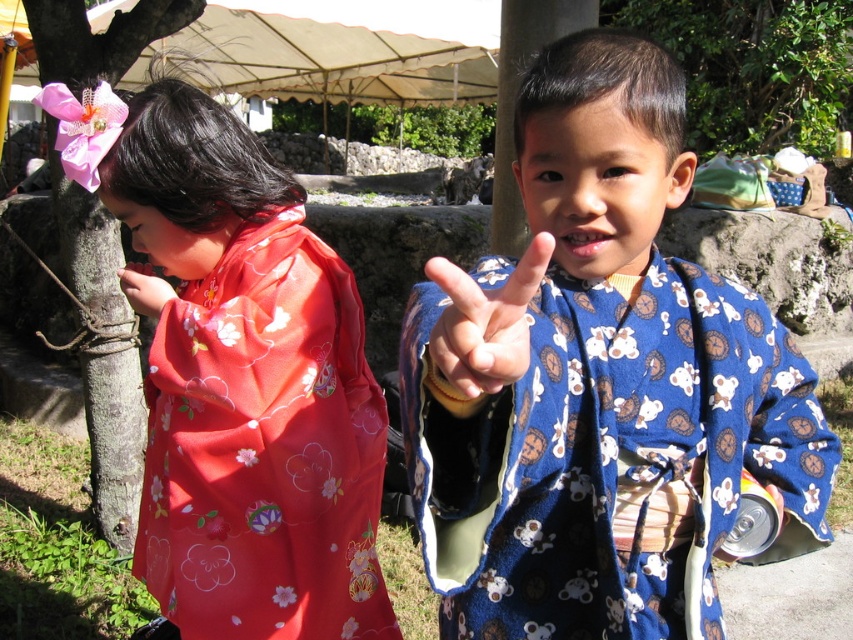
You are a photographer standing at the point marked as point [495,480]. You want to take a photo that includes both children. Given that your camera has a 30 inch field of view, will you be able to capture both children in a single shot?

Yes, the children are 29.13 inches apart, which is within the camera field of view of 30 inches, so both can be captured in a single shot.